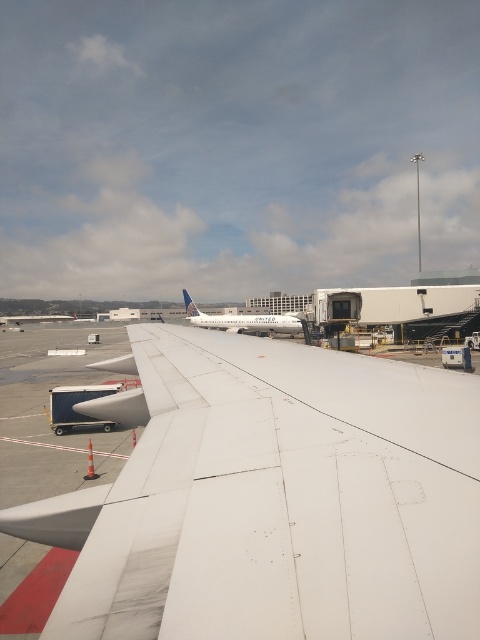
You are a maintenance worker at the airport and need to determine which object is taller between the white matte airplane at center and the white matte airplane tail at center. Based on the scene, which one is taller?

The white matte airplane at center is taller than the white matte airplane tail at center.

You are an airport maintenance worker who needs to clean both the white matte wing at center and the white matte airplane at center. Given that your cleaning equipment can only handle objects that take up more space, which object should you prioritize?

The white matte airplane at center should be prioritized because it occupies more space than the white matte wing at center, making it the larger object that requires attention first.

From the picture: You are an airport maintenance worker who needs to inspect both the white matte wing at center and the white matte airplane tail at center. Based on their positions, which object should you check first if you are approaching from the left side of the scene?

The white matte airplane tail at center should be checked first since it is positioned to the left of the white matte wing at center when approaching from the left side of the scene.